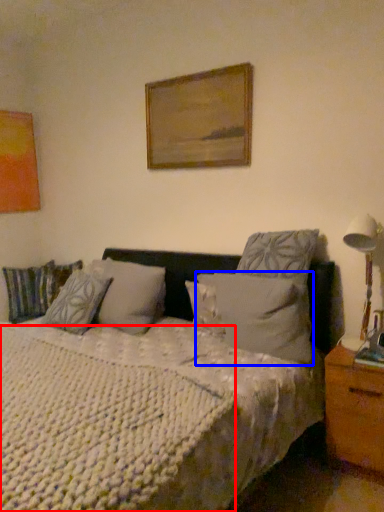
Question: Which point is closer to the camera, mattress (highlighted by a red box) or pillow (highlighted by a blue box)?

Choices:
 (A) mattress
 (B) pillow

Answer: (A)